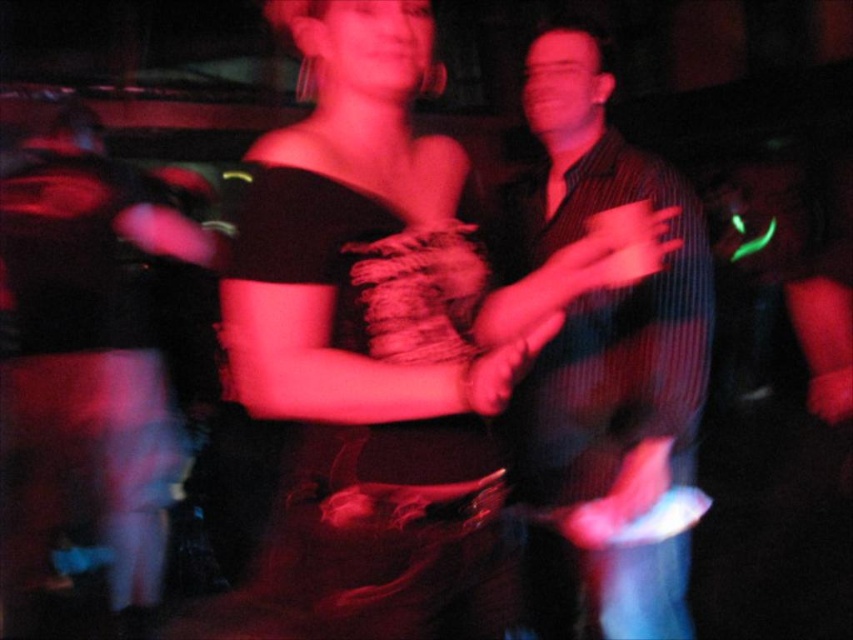
You are a photographer at the event and want to capture a closeup shot of both the matte black dress at center and the striped shirt at center in the same frame. Based on their current positions, is it possible to fit both into a camera frame that has a maximum width of 15 inches?

The matte black dress at center and striped shirt at center are 12.86 inches apart, so yes, they can both fit within a 15 inch frame since the distance between them is less than the frame width.